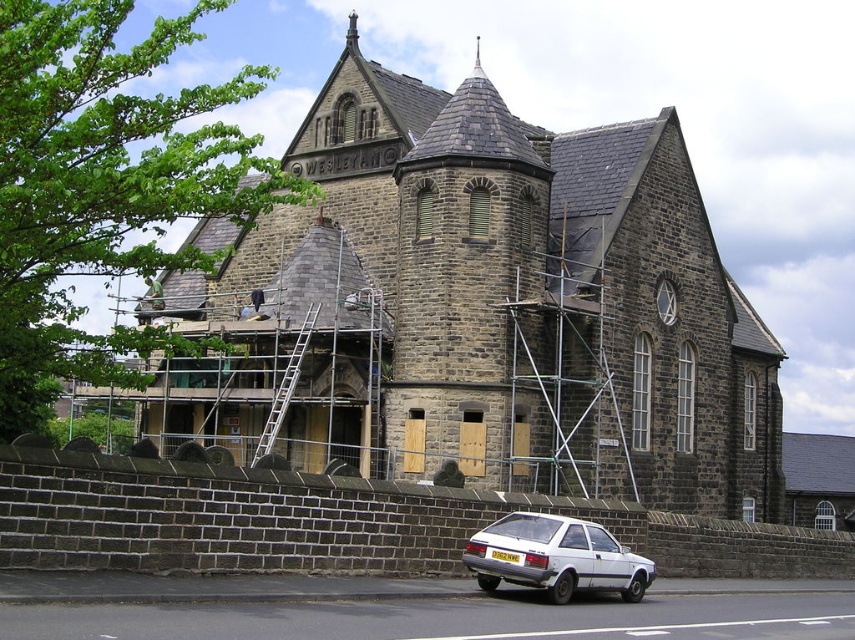
Question: Among these objects, which one is farthest from the camera?

Choices:
 (A) silver metallic ladder at center
 (B) white matte hatchback at lower center
 (C) dark gray stone church at center

Answer: (A)

Question: Is white matte hatchback at lower center below silver metallic ladder at center?

Choices:
 (A) yes
 (B) no

Answer: (A)

Question: Estimate the real-world distances between objects in this image. Which object is closer to the dark gray stone church at center?

Choices:
 (A) silver metallic ladder at center
 (B) white matte hatchback at lower center

Answer: (A)

Question: Does dark gray stone church at center appear on the right side of silver metallic ladder at center?

Choices:
 (A) no
 (B) yes

Answer: (B)

Question: Can you confirm if dark gray stone church at center is smaller than white matte hatchback at lower center?

Choices:
 (A) no
 (B) yes

Answer: (A)

Question: Which of the following is the farthest from the observer?

Choices:
 (A) silver metallic ladder at center
 (B) dark gray stone church at center
 (C) white matte hatchback at lower center

Answer: (A)